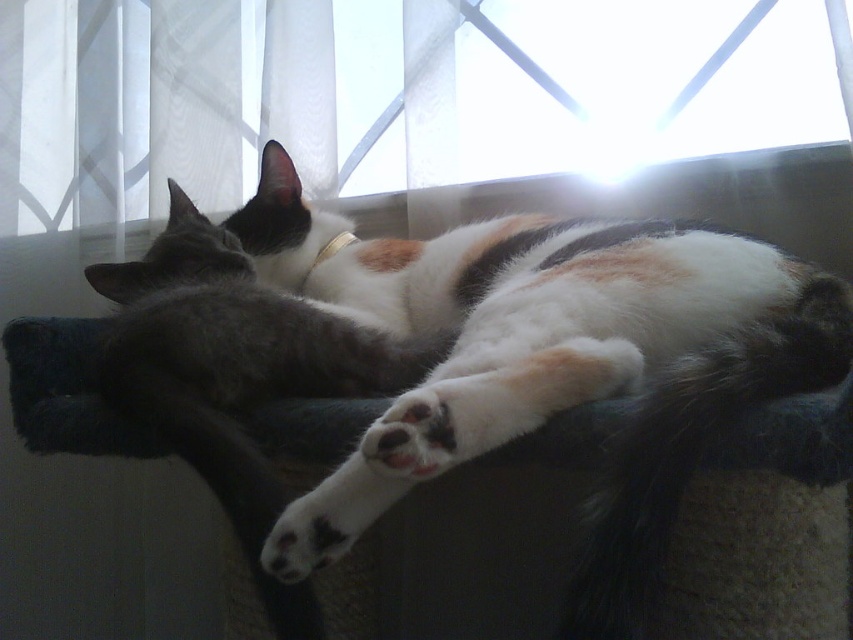
You are a cat owner trying to locate your cats. You see the white fur at center and the transparent glass window at upper center. Which object is closer to the right edge of the image?

The white fur at center is positioned on the right side of transparent glass window at upper center, so the white fur at center is closer to the right edge of the image.